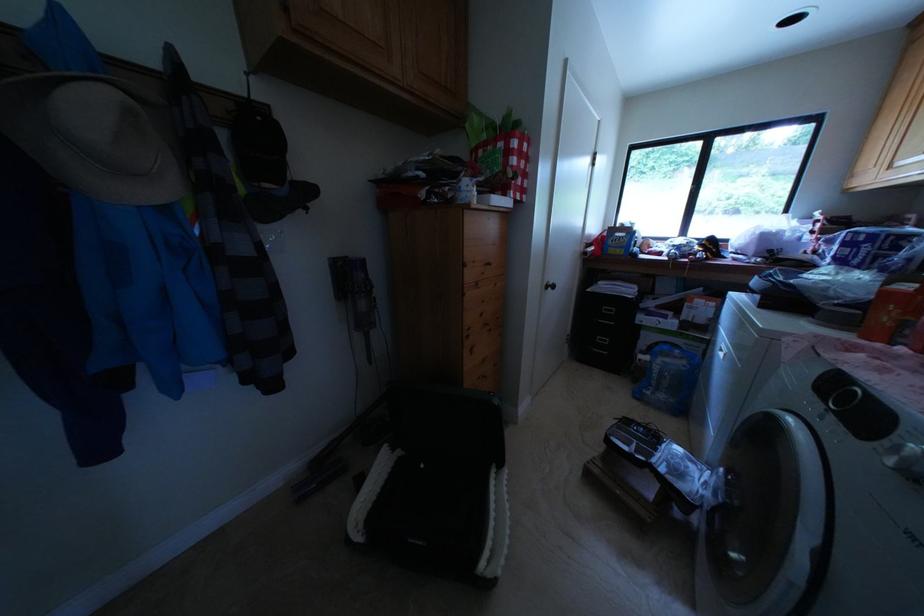
Find where to pull the washing machine handle. Please return your answer as a coordinate pair (x, y).

(786, 588)